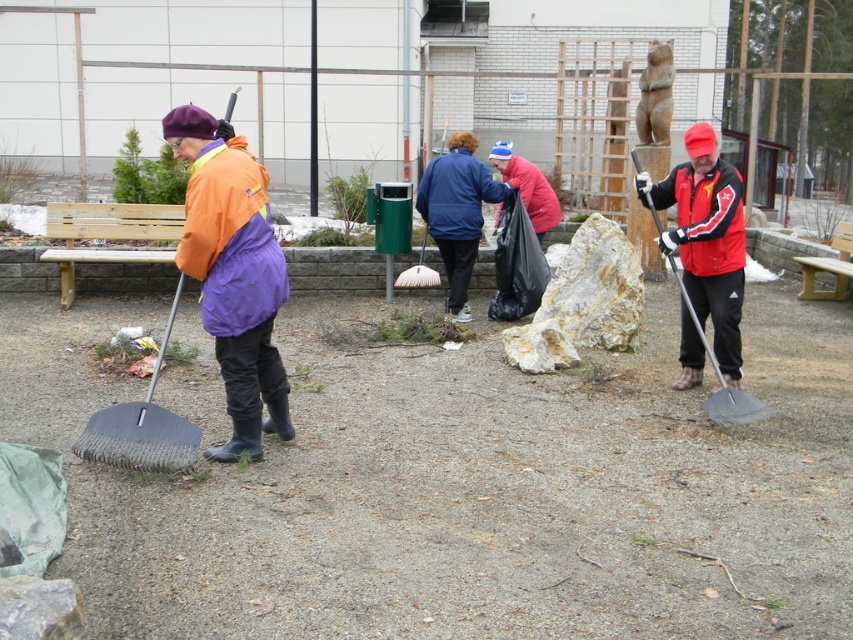
Does red matte jacket at right have a smaller size compared to red matte jacket at center?

Actually, red matte jacket at right might be larger than red matte jacket at center.

Is red matte jacket at right above red matte jacket at center?

No, red matte jacket at right is not above red matte jacket at center.

Describe the element at coordinates (703, 218) in the screenshot. Image resolution: width=853 pixels, height=640 pixels. I see `red matte jacket at right` at that location.

Where is `red matte jacket at right`? This screenshot has height=640, width=853. red matte jacket at right is located at coordinates (703, 218).

Find the location of a particular element. orange matte jacket at left is located at coordinates (x=231, y=275).

Does orange matte jacket at left appear over dark gray rubber shovel at left?

Indeed, orange matte jacket at left is positioned over dark gray rubber shovel at left.

Which is behind, point (227, 396) or point (151, 378)?

Point (151, 378)

The image size is (853, 640). Find the location of `orange matte jacket at left`. orange matte jacket at left is located at coordinates (231, 275).

Can you confirm if blue fabric jacket at center is wider than dark gray rubber shovel at left?

Yes, blue fabric jacket at center is wider than dark gray rubber shovel at left.

Is blue fabric jacket at center thinner than dark gray rubber shovel at left?

No.

At what (x,y) coordinates should I click in order to perform the action: click on blue fabric jacket at center. Please return your answer as a coordinate pair (x, y). The image size is (853, 640). Looking at the image, I should click on (457, 212).

You are a GUI agent. You are given a task and a screenshot of the screen. Output one action in this format:
    pyautogui.click(x=<x>, y=<y>)
    Task: Click on the blue fabric jacket at center
    The width and height of the screenshot is (853, 640).
    Given the screenshot: What is the action you would take?
    pyautogui.click(x=457, y=212)